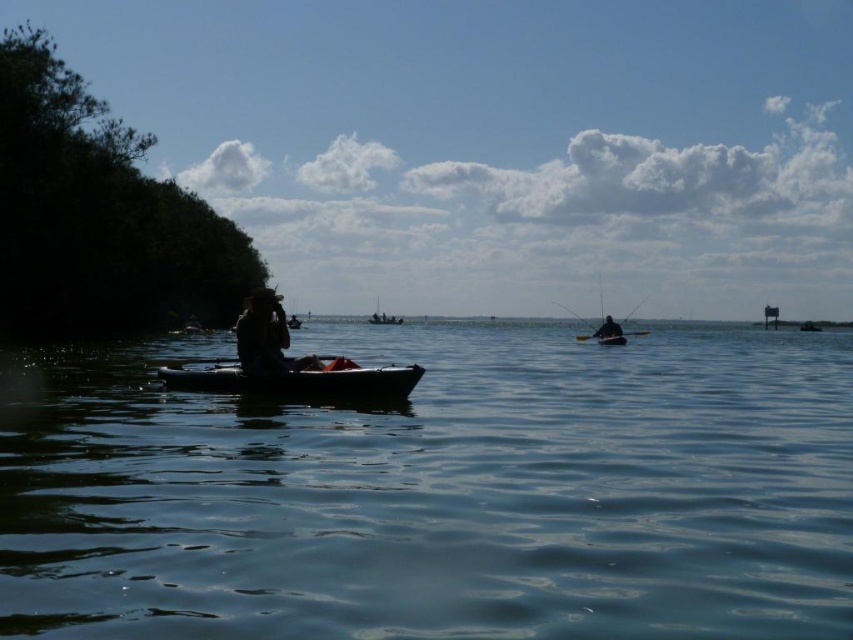
You are a kayaker in the middle of the water. You need to know if the transparent blue water at center is wider than the black plastic paddle at center. Can you determine this based on the scene?

The transparent blue water at center is wider than the black plastic paddle at center, so yes, the transparent blue water at center is wider than the black plastic paddle at center.

Based on the photo, you are in a boat and need to know if you can lift the black plastic paddle at center over the smooth black canoe at center. Can you do that?

The black plastic paddle at center is not as tall as smooth black canoe at center, so you can lift the black plastic paddle at center over the smooth black canoe at center because it is shorter.

You are in a boat and need to grab the black plastic paddle at center to row towards the smooth black canoe at center. Which direction should you move the paddle to steer towards the canoe?

Since the black plastic paddle at center is to the right of the smooth black canoe at center, you should move the paddle to the right to steer the boat towards the canoe.